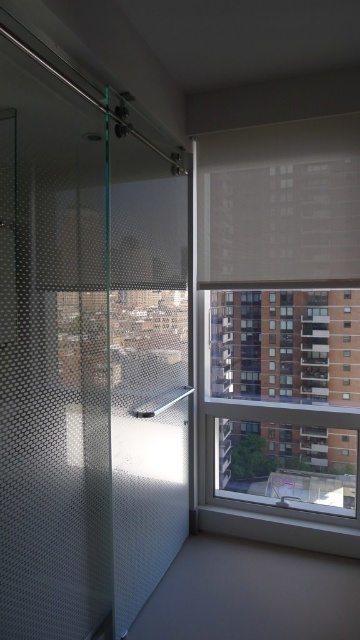
You are a window cleaner standing in the bathroom. You need to clean the white matte blind at upper center and the satin nickel shower at center. Which object is closer to you so you can start cleaning first?

The white matte blind at upper center is closer to you than the satin nickel shower at center, so you should start cleaning the white matte blind at upper center first.

You are designing a bathroom layout and need to ensure that the white matte blind at upper center and the satin nickel shower at center are spaced appropriately. Given their sizes, which object requires more horizontal space in the bathroom?

The white matte blind at upper center requires more horizontal space because it is larger in size than the satin nickel shower at center.